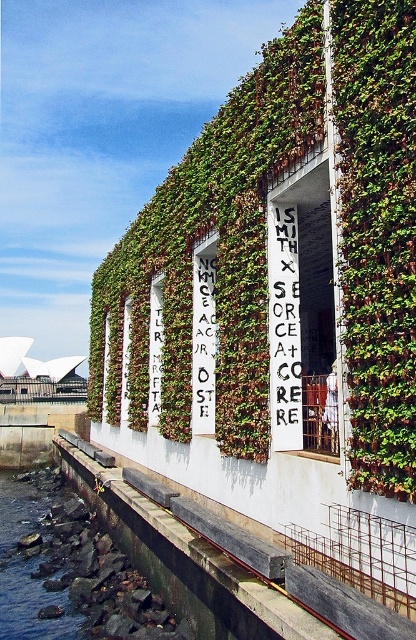
Question: Which point is farther from the camera taking this photo?

Choices:
 (A) (277, 445)
 (B) (203, 369)

Answer: (B)

Question: Observing the image, what is the correct spatial positioning of green leafy wall at center in reference to white painted wood sign at center?

Choices:
 (A) left
 (B) right

Answer: (B)

Question: Which point is farther from the camera taking this photo?

Choices:
 (A) (193, 316)
 (B) (32, 477)

Answer: (B)

Question: Is black painted wood sign at center further to camera compared to white painted wood sign at center?

Choices:
 (A) yes
 (B) no

Answer: (B)

Question: Can you confirm if green leafy wall at center is smaller than rocky stone waterway at lower left?

Choices:
 (A) yes
 (B) no

Answer: (B)

Question: Which object is positioned closest to the white painted wood sign at center?

Choices:
 (A) black painted wood sign at center
 (B) green leafy wall at center
 (C) rocky stone waterway at lower left

Answer: (B)